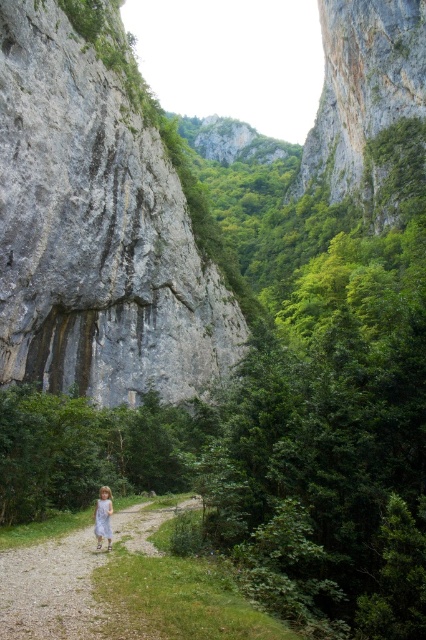
Question: Can you confirm if gravel path at center is positioned above white cotton dress at center?

Choices:
 (A) no
 (B) yes

Answer: (A)

Question: Which point is farther to the camera?

Choices:
 (A) (40, 172)
 (B) (109, 522)
 (C) (354, 189)

Answer: (C)

Question: Can you confirm if rough stone cliff at upper center is wider than white cotton dress at center?

Choices:
 (A) yes
 (B) no

Answer: (A)

Question: Which object appears closest to the camera in this image?

Choices:
 (A) rough stone cliff at upper center
 (B) white lace dress at lower left
 (C) rough gray rock at center

Answer: (B)

Question: Is rough gray rock at center behind gravel path at center?

Choices:
 (A) no
 (B) yes

Answer: (B)

Question: Which point appears closest to the camera in this image?

Choices:
 (A) (109, 540)
 (B) (14, 602)
 (C) (97, 534)

Answer: (B)